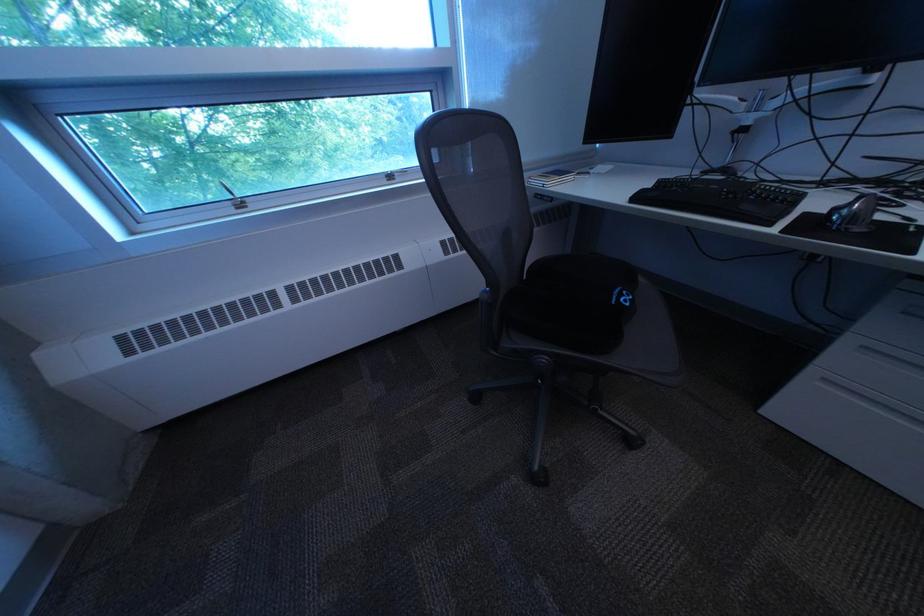
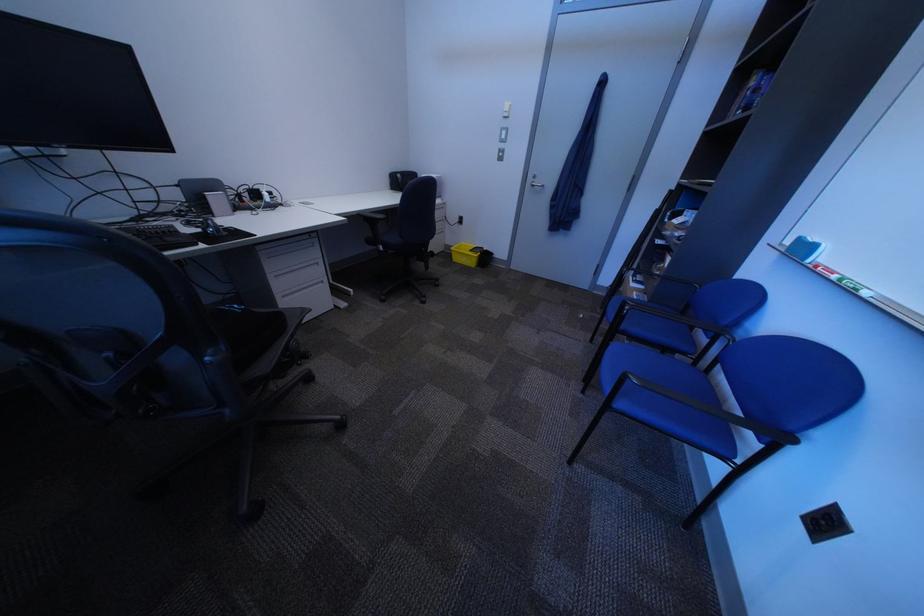
Locate, in the second image, the point that corresponds to (633,292) in the first image.

(238, 310)